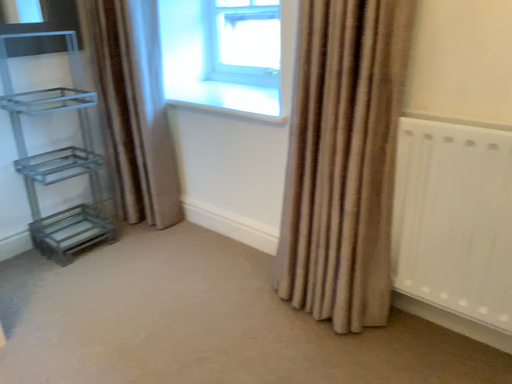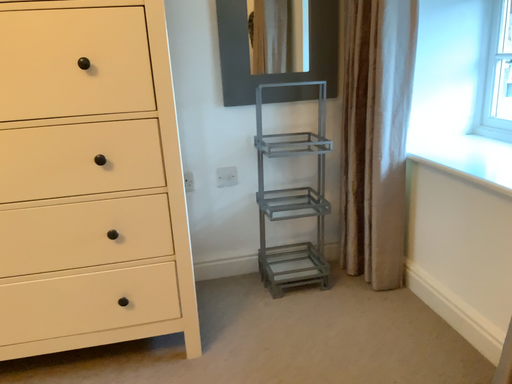
Question: How did the camera likely rotate when shooting the video?

Choices:
 (A) rotated downward
 (B) rotated upward

Answer: (B)